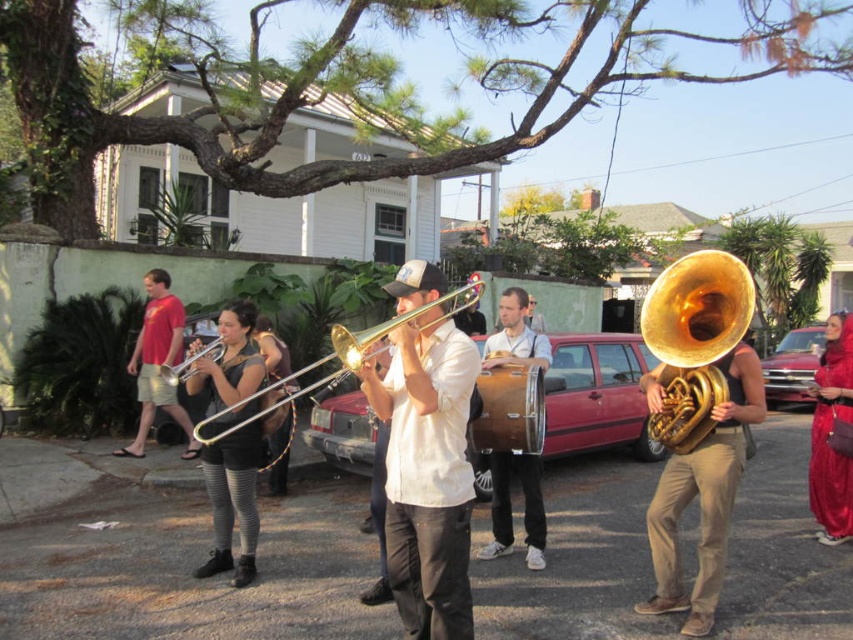
You are a photographer trying to capture the band members in the scene. You notice two points marked in the image. Which point, point 1 at coordinates (415, 490) or point 2 at coordinates (198, 433), is closer to your camera lens?

Point 1 at coordinates (415, 490) is closer to the camera lens than point 2 at coordinates (198, 433).

You are a photographer trying to capture a group photo of the band members. You notice the black jersey at center and the wooden drum at center. Which object should you adjust your camera focus to include more of, considering their sizes?

The black jersey at center has a larger width than the wooden drum at center, so you should adjust your camera focus to include more of the black jersey at center.